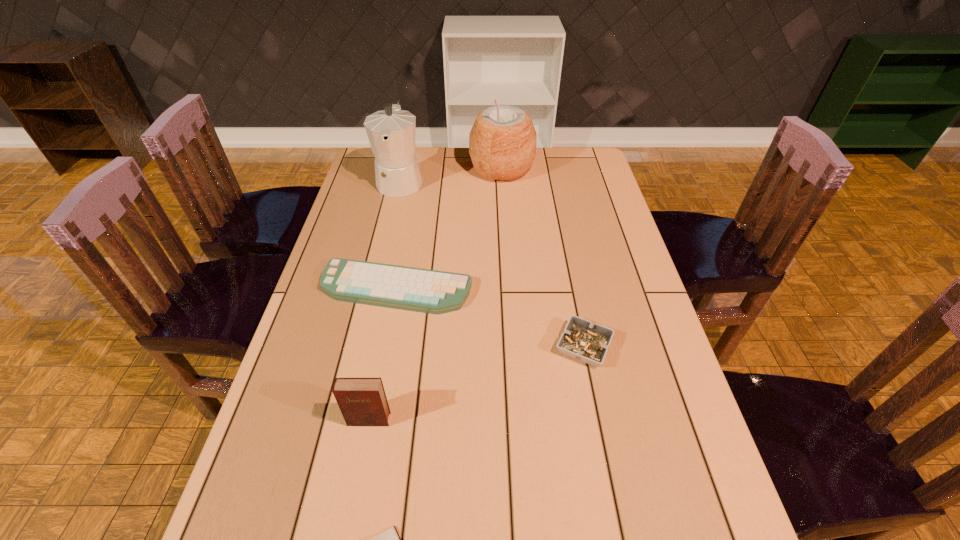
Where is `vacant space at the right edge of the desktop`? vacant space at the right edge of the desktop is located at coordinates (640, 526).

The width and height of the screenshot is (960, 540). In the image, there is a desktop. Identify the location of vacant region at the far left corner. (373, 158).

Where is `vacant region at the far right corner of the desktop`? This screenshot has height=540, width=960. vacant region at the far right corner of the desktop is located at coordinates (584, 169).

At what (x,y) coordinates should I click in order to perform the action: click on unoccupied position between the ashtray and the coffeepot. Please return your answer as a coordinate pair (x, y). The height and width of the screenshot is (540, 960). Looking at the image, I should click on (492, 264).

Locate an element on the screen. The width and height of the screenshot is (960, 540). free space that is in between the taller diary and the fifth tallest object is located at coordinates (383, 354).

Find the location of `vacant region between the coconut and the coffeepot`. vacant region between the coconut and the coffeepot is located at coordinates (451, 175).

The height and width of the screenshot is (540, 960). In order to click on vacant space in between the coconut and the ashtray in this screenshot , I will do `click(542, 258)`.

Identify the location of vacant area that lies between the coconut and the ashtray. The width and height of the screenshot is (960, 540). (542, 258).

What are the coordinates of `object that is the fifth nearest to the nearest object` in the screenshot? It's located at (502, 142).

This screenshot has width=960, height=540. Find the location of `object that ranks as the fifth closest to the shortest object`. object that ranks as the fifth closest to the shortest object is located at coordinates (502, 142).